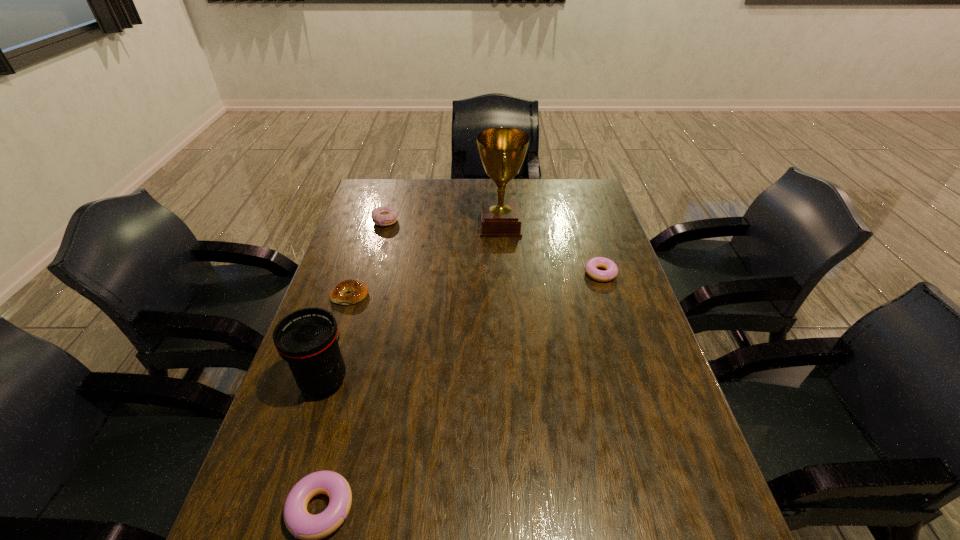
Identify the location of free location located 0.070m on the plaque of the tallest object. This screenshot has height=540, width=960. (458, 225).

In order to click on vacant space positioned 0.180m on the plaque of the tallest object in this screenshot , I will do `click(426, 225)`.

Identify the location of vacant space situated 0.240m on the plaque of the tallest object. Image resolution: width=960 pixels, height=540 pixels. click(410, 225).

At what (x,y) coordinates should I click in order to perform the action: click on vacant space located on the front of the fourth farthest object. Please return your answer as a coordinate pair (x, y). The width and height of the screenshot is (960, 540). Looking at the image, I should click on (342, 322).

At what (x,y) coordinates should I click in order to perform the action: click on free point located on the right of the fifth farthest object. Please return your answer as a coordinate pair (x, y). This screenshot has width=960, height=540. Looking at the image, I should click on (504, 381).

Locate an element on the screen. object positioned at the far edge is located at coordinates (502, 151).

Locate an element on the screen. The image size is (960, 540). doughnut located in the left edge section of the desktop is located at coordinates (382, 216).

What are the coordinates of `bagel present at the left edge` in the screenshot? It's located at (358, 290).

Where is `telephoto lens that is at the left edge`? telephoto lens that is at the left edge is located at coordinates (307, 339).

Locate an element on the screen. This screenshot has width=960, height=540. object at the right edge is located at coordinates (610, 273).